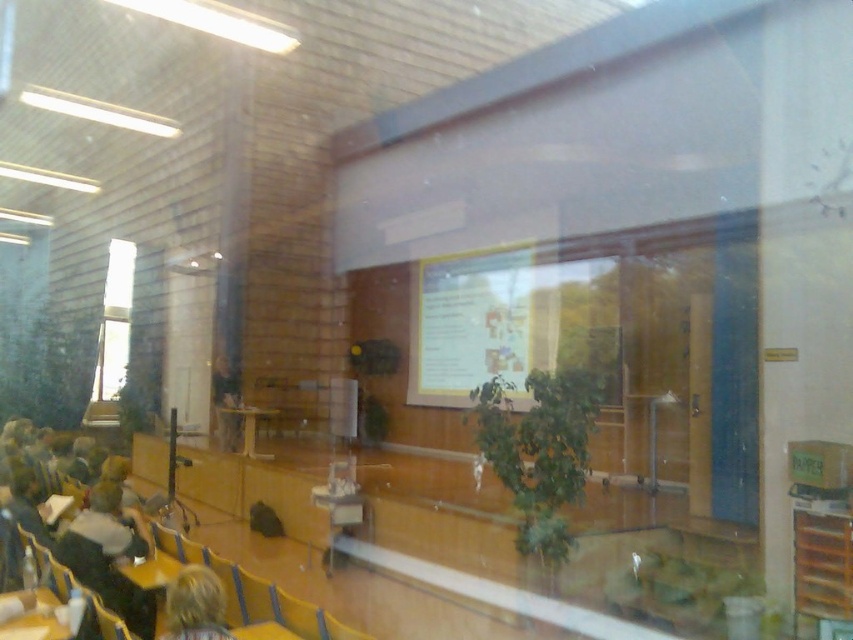
Question: Which of the following is the closest to the observer?

Choices:
 (A) (468, 385)
 (B) (111, 499)
 (C) (221, 355)
 (D) (195, 602)

Answer: (D)

Question: Which of these objects is positioned closest to the yellow paper at center?

Choices:
 (A) light brown leather jacket at lower left
 (B) blonde hair at lower left
 (C) matte black laptop at center

Answer: (C)

Question: Does yellow paper at center appear on the left side of matte black laptop at center?

Choices:
 (A) yes
 (B) no

Answer: (B)

Question: Does blonde hair at lower left appear on the right side of light brown leather jacket at lower left?

Choices:
 (A) no
 (B) yes

Answer: (B)

Question: Which object appears closest to the camera in this image?

Choices:
 (A) matte black laptop at center
 (B) blonde hair at lower left
 (C) light brown leather jacket at lower left
 (D) yellow paper at center

Answer: (B)

Question: Where is yellow paper at center located in relation to blonde hair at lower left in the image?

Choices:
 (A) left
 (B) right

Answer: (B)